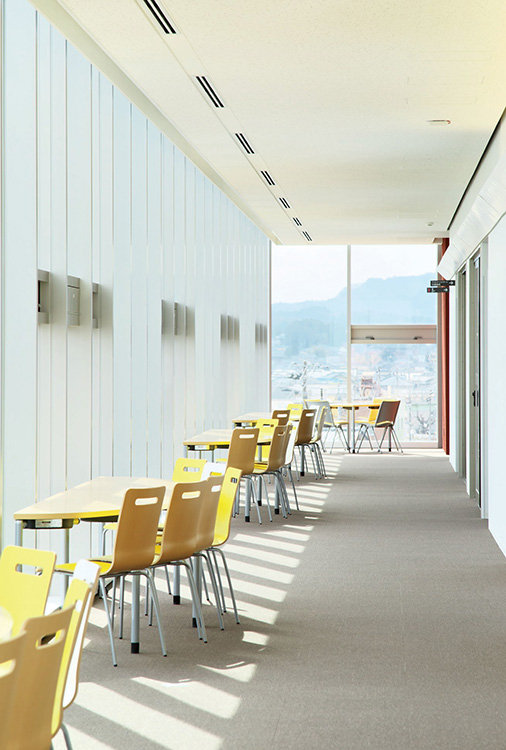
Find the location of `ceiling vents`. ceiling vents is located at coordinates (165, 26), (209, 91), (245, 144), (270, 181), (284, 201), (298, 224), (305, 230).